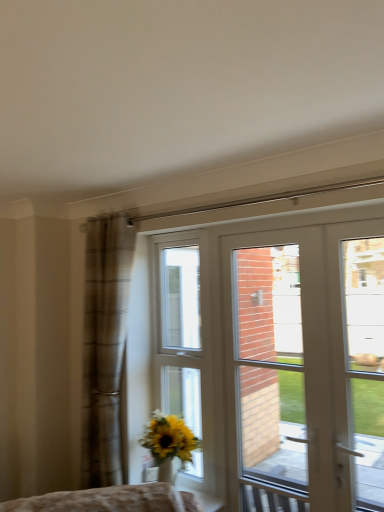
Question: Is white glossy door at center outside brown plaid curtain at left?

Choices:
 (A) no
 (B) yes

Answer: (B)

Question: Considering the relative sizes of white glossy door at center and brown plaid curtain at left in the image provided, is white glossy door at center shorter than brown plaid curtain at left?

Choices:
 (A) no
 (B) yes

Answer: (A)

Question: Considering the relative sizes of white glossy door at center and brown plaid curtain at left in the image provided, is white glossy door at center thinner than brown plaid curtain at left?

Choices:
 (A) no
 (B) yes

Answer: (B)

Question: Would you consider white glossy door at center to be distant from brown plaid curtain at left?

Choices:
 (A) no
 (B) yes

Answer: (A)

Question: Is white glossy door at center wider than brown plaid curtain at left?

Choices:
 (A) yes
 (B) no

Answer: (B)

Question: Would you say brown plaid curtain at left is part of white glossy door at center's contents?

Choices:
 (A) yes
 (B) no

Answer: (B)

Question: Considering the relative sizes of white glossy window at center and white glass door at right in the image provided, is white glossy window at center wider than white glass door at right?

Choices:
 (A) no
 (B) yes

Answer: (A)

Question: From a real-world perspective, is white glossy window at center positioned over white glass door at right based on gravity?

Choices:
 (A) no
 (B) yes

Answer: (A)

Question: From the image's perspective, is white glossy window at center beneath white glass door at right?

Choices:
 (A) yes
 (B) no

Answer: (A)

Question: Is white glossy window at center positioned before white glass door at right?

Choices:
 (A) yes
 (B) no

Answer: (B)

Question: Can white glass door at right be found inside white glossy window at center?

Choices:
 (A) no
 (B) yes

Answer: (A)

Question: From the image's perspective, is white glossy window at center located above white glass door at right?

Choices:
 (A) no
 (B) yes

Answer: (A)

Question: Can you confirm if white glossy door at center is wider than white glass door at right?

Choices:
 (A) yes
 (B) no

Answer: (B)